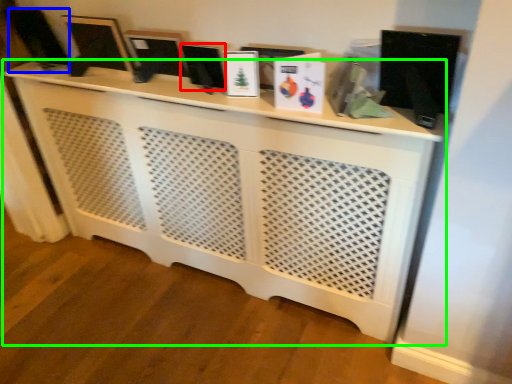
Question: Which object is the farthest from computer monitor (highlighted by a red box)? Choose among these: computer monitor (highlighted by a blue box) or furniture (highlighted by a green box).

Choices:
 (A) computer monitor
 (B) furniture

Answer: (A)